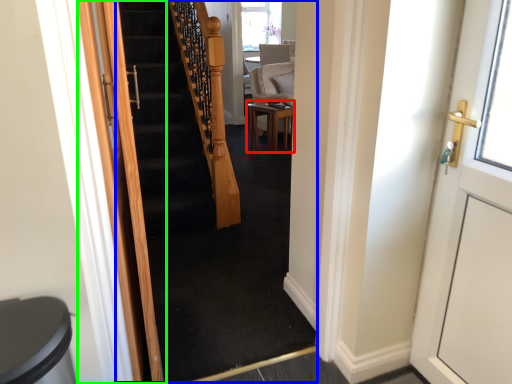
Question: Which object is positioned closest to table (highlighted by a red box)? Select from escalator (highlighted by a blue box) and door (highlighted by a green box).

Choices:
 (A) escalator
 (B) door

Answer: (A)